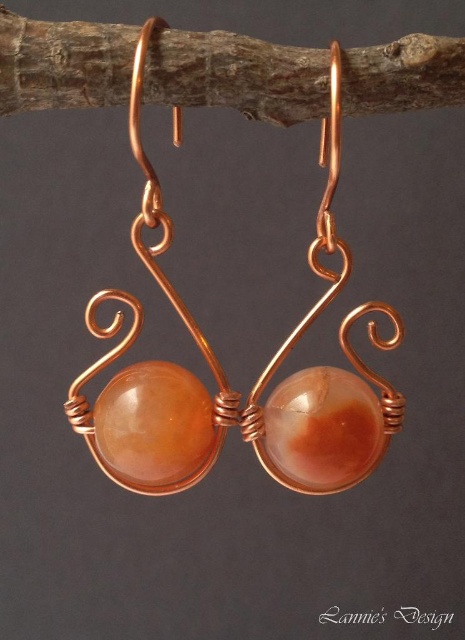
Based on the photo, you are a jeweler who wants to display the copper wire wrapped earrings at center in a showcase. The showcase has a glass panel that is 20 centimeters wide. Can you fit the earrings and the brown wood at upper center into the showcase without overlapping?

The distance between the copper wire wrapped earrings at center and the brown wood at upper center is 22.25 centimeters. Since the showcase glass panel is only 20 centimeters wide, they cannot be placed side by side without overlapping.

You are looking at the earrings from the front. There are two points marked on the earrings. The first point is at coordinate point (334, 275) and the second is at point (94, 93). Which point is closer to your eyes?

Point (334, 275) is closer to the camera than point (94, 93), so the first point is closer to your eyes.

You are an artisan creating a display for a jewelry store. You have a small brown wood at upper center and want to place the copper wire wrapped earrings at center nearby. Based on their sizes, which object should be placed closer to the customer for better visibility?

The copper wire wrapped earrings at center is bigger than the brown wood at upper center, so placing them closer to the customer will ensure better visibility due to their larger size.